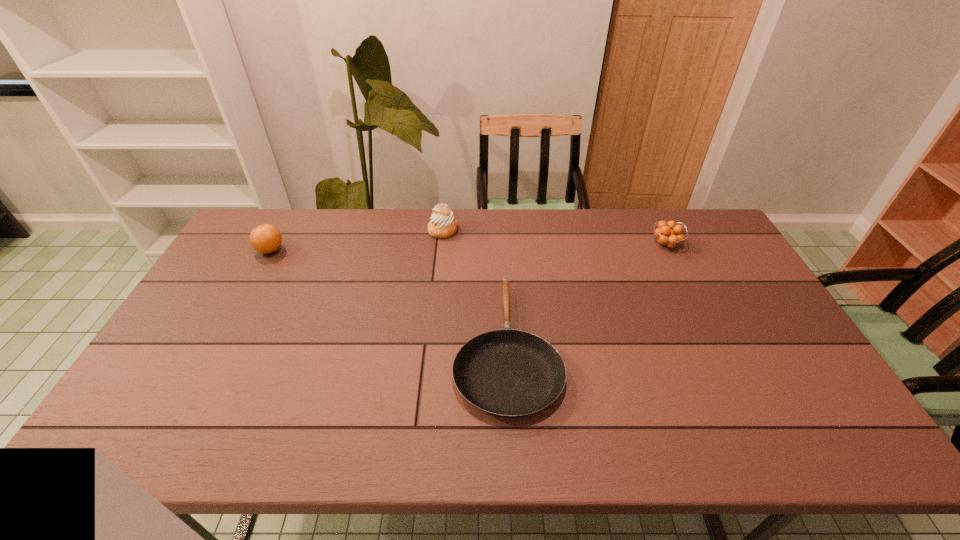
Where is `vacant space at the far right corner of the desktop`? The image size is (960, 540). vacant space at the far right corner of the desktop is located at coordinates (703, 245).

What are the coordinates of `blank region between the shortest object and the third tallest object` in the screenshot? It's located at (587, 295).

Find the location of a particular element. This screenshot has width=960, height=540. empty space that is in between the second object from right to left and the pastry is located at coordinates (475, 288).

Where is `vacant space that is in between the pastry and the left orange fruit`? vacant space that is in between the pastry and the left orange fruit is located at coordinates (357, 240).

You are a GUI agent. You are given a task and a screenshot of the screen. Output one action in this format:
    pyautogui.click(x=<x>, y=<y>)
    Task: Click on the vacant space in between the third object from right to left and the left orange fruit
    
    Given the screenshot: What is the action you would take?
    pyautogui.click(x=357, y=240)

This screenshot has height=540, width=960. I want to click on free space that is in between the third object from right to left and the frying pan, so click(475, 288).

The height and width of the screenshot is (540, 960). What are the coordinates of `unoccupied position between the nearest object and the right orange fruit` in the screenshot? It's located at (587, 295).

Identify the location of vacant area that lies between the right orange fruit and the third object from right to left. (555, 238).

I want to click on free space between the shortest object and the left orange fruit, so click(x=389, y=298).

Image resolution: width=960 pixels, height=540 pixels. I want to click on free space between the left orange fruit and the right orange fruit, so click(x=468, y=247).